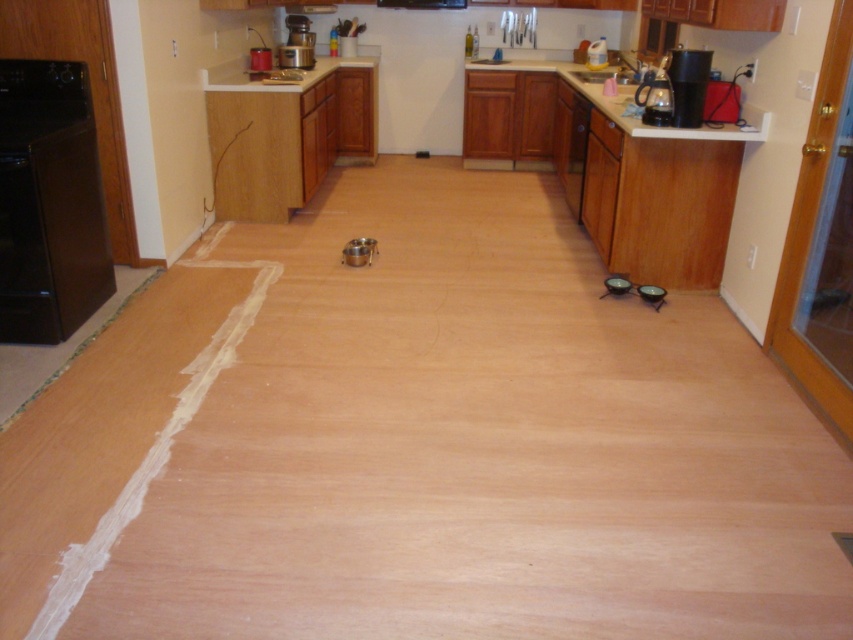
You are a kitchen designer and need to install a new faucet. You see the satin silver toaster at upper center and the white glossy sink at upper center. Which object is located above the other?

The satin silver toaster at upper center is positioned over the white glossy sink at upper center, so the satin silver toaster is above the white glossy sink.

You are standing in the kitchen and want to reach both the point at coordinates (38, 179) and the point at coordinates (608, 74). Which point will you reach first?

You will reach the point at coordinates (38, 179) first because it is closer to you than the point at coordinates (608, 74).

You are standing in the kitchen and see two points marked on the floor. The first point is at coordinate point(291, 61) and the second is at point(606, 68). Which point is closer to you?

Point(291, 61) is closer to the viewer than point(606, 68).